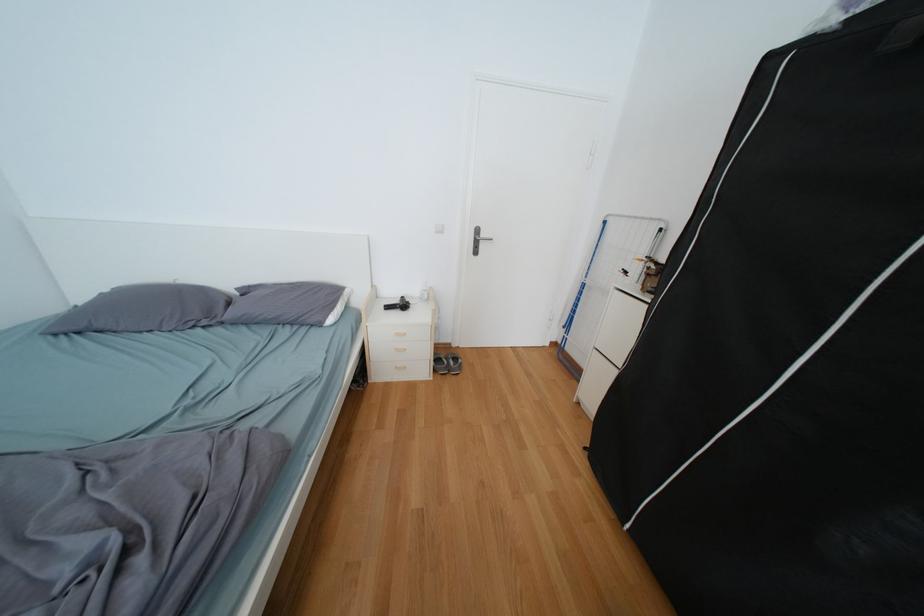
The height and width of the screenshot is (616, 924). In order to click on white drawer handle in this screenshot , I will do `click(399, 365)`.